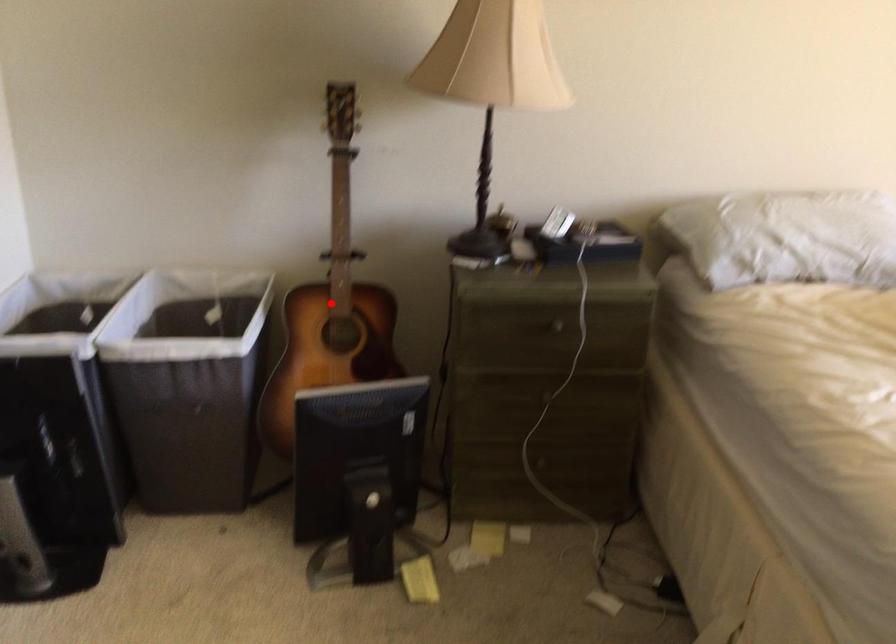
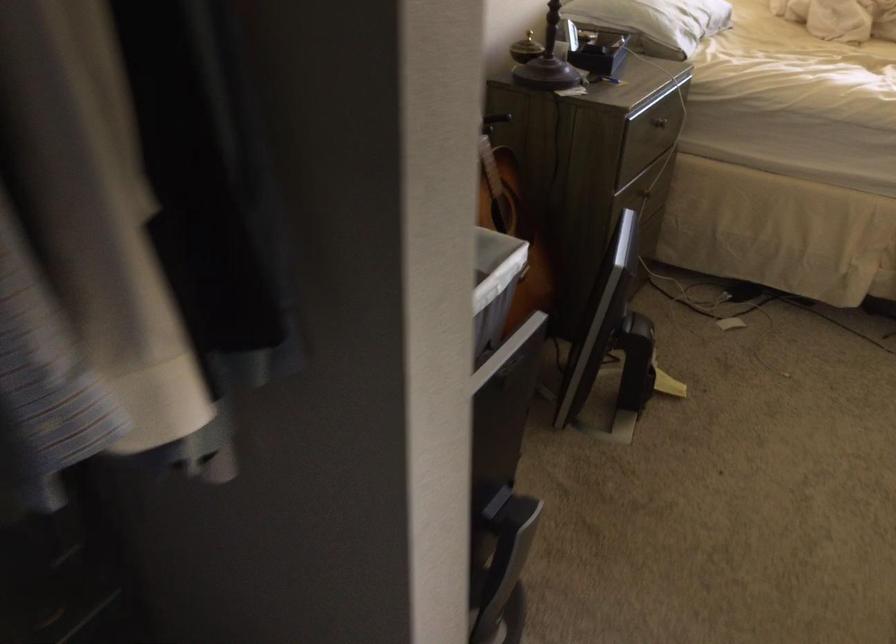
Question: I am providing you with two images of the same scene from different viewpoints. A red point is marked on the first image. At the location where the point appears in image 1, is it still visible in image 2?

Choices:
 (A) Yes
 (B) No

Answer: (B)